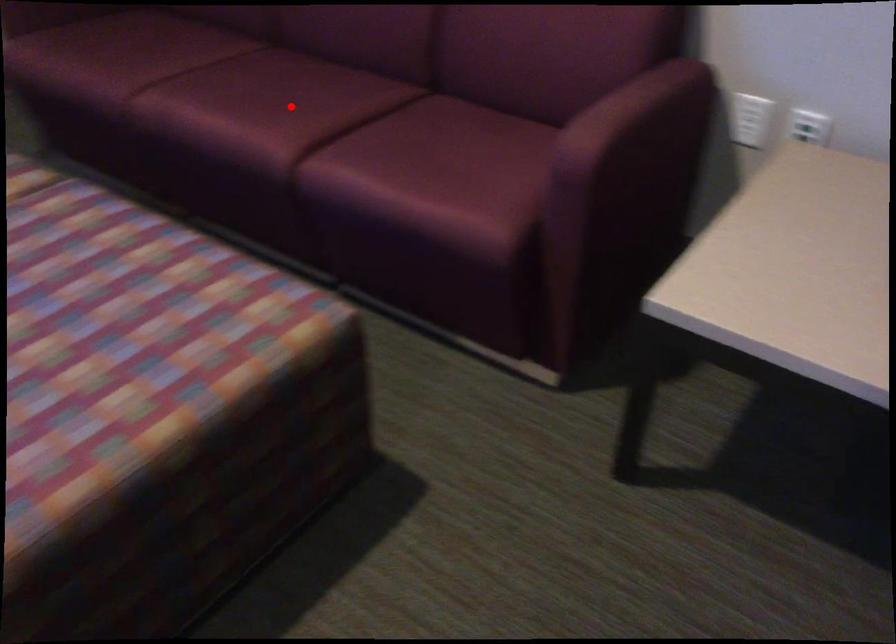
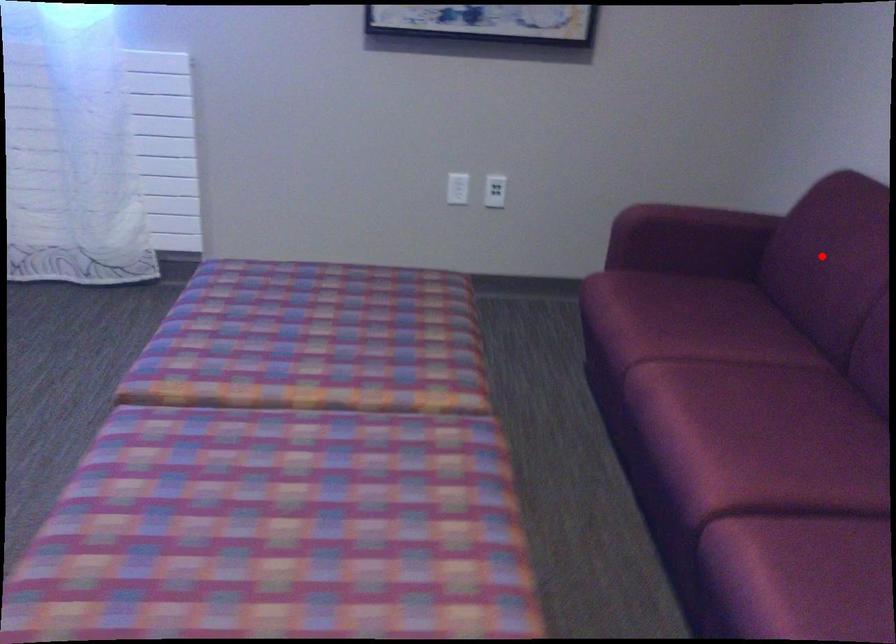
I am providing you with two images of the same scene from different viewpoints. A red point is marked on the first image and another point is marked on the second image. Is the marked point in image1 the same physical position as the marked point in image2?

No